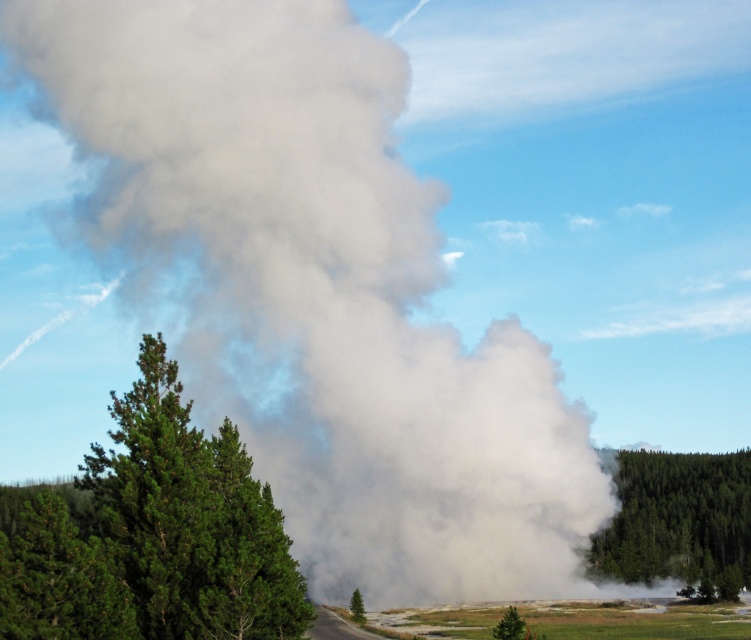
From the picture: You are a hiker standing on the road and want to take a photo of both the green textured tree at left and the green textured tree at lower right. Which tree should you move closer to in order to include both in your camera frame?

The green textured tree at left is taller than the green textured tree at lower right. To include both in your camera frame, you should move closer to the green textured tree at lower right so that the taller tree at left doesn